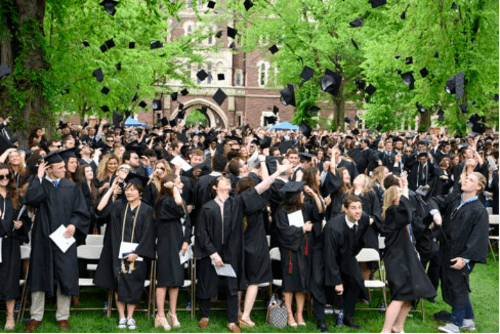
Locate an element on the screen. The image size is (500, 334). white chair is located at coordinates (87, 250), (86, 281).